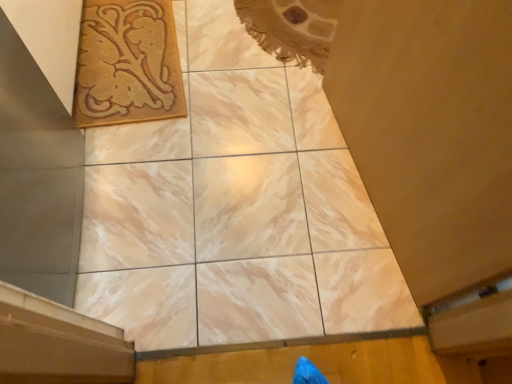
The image size is (512, 384). I want to click on vacant region below marble tile at center (from a real-world perspective), so click(222, 206).